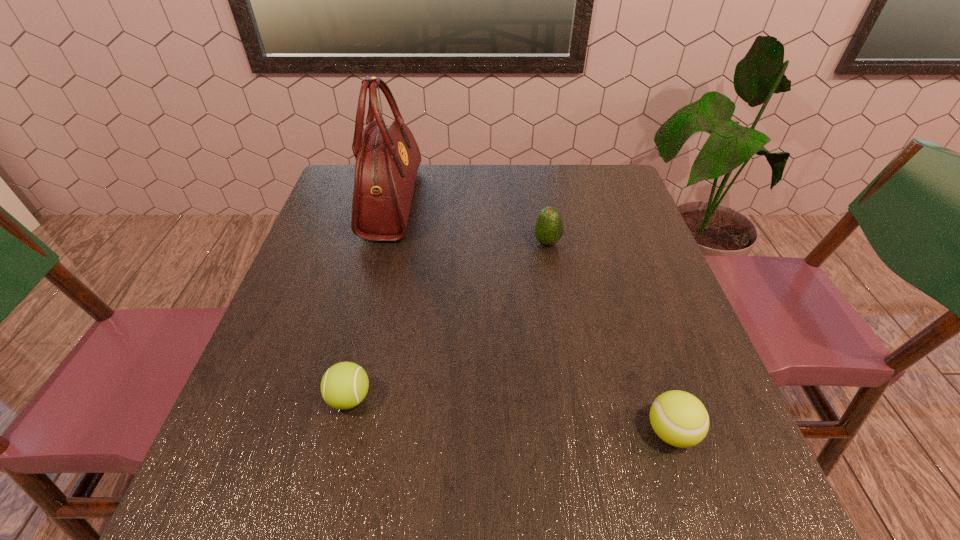
This screenshot has width=960, height=540. Identify the location of handbag located in the left edge section of the desktop. (387, 158).

You are a GUI agent. You are given a task and a screenshot of the screen. Output one action in this format:
    pyautogui.click(x=<x>, y=<y>)
    Task: Click on the tennis ball located at the left edge
    The image size is (960, 540).
    Given the screenshot: What is the action you would take?
    pyautogui.click(x=344, y=385)

Where is `object at the right edge`? The width and height of the screenshot is (960, 540). object at the right edge is located at coordinates (680, 419).

This screenshot has width=960, height=540. I want to click on object that is at the far left corner, so click(x=387, y=158).

The width and height of the screenshot is (960, 540). What are the coordinates of `vacant area at the far edge` in the screenshot? It's located at (477, 200).

Where is `vacant space at the near edge of the desktop`? The height and width of the screenshot is (540, 960). vacant space at the near edge of the desktop is located at coordinates (659, 517).

Image resolution: width=960 pixels, height=540 pixels. In order to click on free location at the left edge of the desktop in this screenshot , I will do `click(266, 378)`.

The image size is (960, 540). In the image, there is a desktop. Find the location of `vacant space at the right edge`. vacant space at the right edge is located at coordinates (648, 254).

This screenshot has height=540, width=960. What are the coordinates of `vacant area at the near left corner of the desktop` in the screenshot? It's located at (267, 494).

Locate an element on the screen. free space between the second tallest object and the right tennis ball is located at coordinates (609, 337).